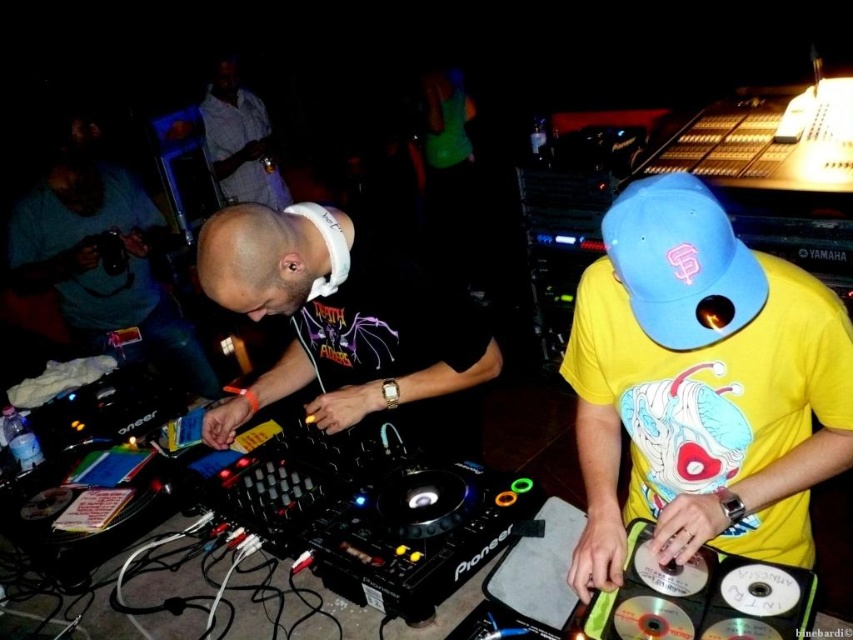
You are a photographer at the nightclub scene. You need to take a photo that includes both the white matte headphones at center and the striped shirt at upper left. Since you want to ensure both objects are clearly visible, which object should you adjust your camera focus on first to account for their sizes?

The white matte headphones at center is wider than the striped shirt at upper left, so you should focus on the white matte headphones at center first to ensure its details are captured clearly before adjusting for the smaller striped shirt at upper left.

You are a photographer positioned at the entrance of the nightclub. You want to capture a photo of the DJ setup. Based on the white matte headphones at center, where should you position your camera to ensure they are centered in the frame?

To center the white matte headphones at center in the frame, position your camera so that the center of the lens aligns with the coordinates point (341,321).